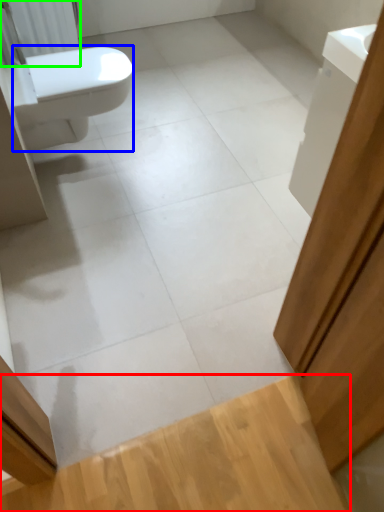
Question: Estimate the real-world distances between objects in this image. Which object is farther from plank (highlighted by a red box), bidet (highlighted by a blue box) or radiator (highlighted by a green box)?

Choices:
 (A) bidet
 (B) radiator

Answer: (B)